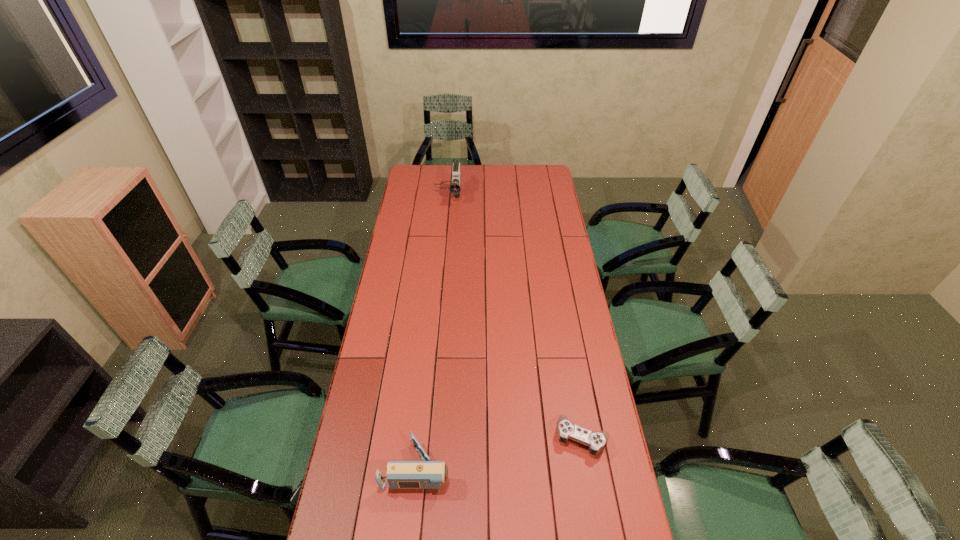
At what (x,y) coordinates should I click in order to perform the action: click on the farthest object. Please return your answer as a coordinate pair (x, y). Image resolution: width=960 pixels, height=540 pixels. Looking at the image, I should click on (455, 188).

Where is `the taller camcorder`? The width and height of the screenshot is (960, 540). the taller camcorder is located at coordinates (455, 188).

Identify the location of the shorter camcorder. (427, 474).

At what (x,y) coordinates should I click in order to perform the action: click on the second tallest object. Please return your answer as a coordinate pair (x, y). The width and height of the screenshot is (960, 540). Looking at the image, I should click on (427, 474).

Identify the location of the rightmost object. The width and height of the screenshot is (960, 540). (596, 441).

The height and width of the screenshot is (540, 960). I want to click on control, so click(596, 441).

At what (x,y) coordinates should I click in order to perform the action: click on free region located on the recording direction of the tallest object. Please return your answer as a coordinate pair (x, y). The image size is (960, 540). Looking at the image, I should click on (443, 248).

Locate an element on the screen. vacant area located 0.300m on the side of the nearer camcorder with the flip-out screen is located at coordinates (544, 467).

Identify the location of free space located on the back of the shortest object. This screenshot has width=960, height=540. (573, 382).

At what (x,y) coordinates should I click in order to perform the action: click on object located at the far edge. Please return your answer as a coordinate pair (x, y). Image resolution: width=960 pixels, height=540 pixels. Looking at the image, I should click on (455, 188).